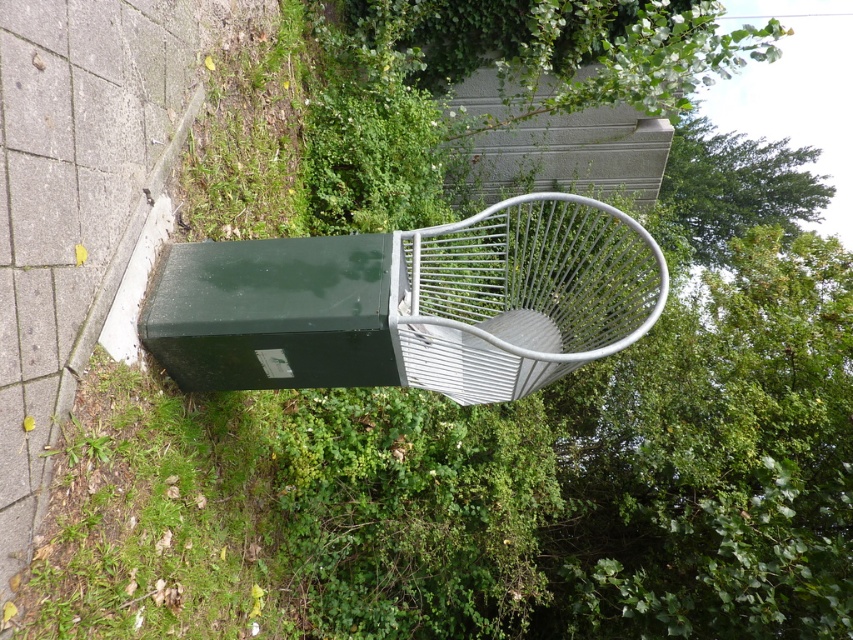
Question: Among these points, which one is farthest from the camera?

Choices:
 (A) (49, 577)
 (B) (335, 1)
 (C) (770, 212)

Answer: (C)

Question: Based on their relative distances, which object is farther from the green grass at lower left?

Choices:
 (A) metallic wire chair at center
 (B) green leafy tree at upper right

Answer: (B)

Question: Does green grass at lower left have a greater width compared to green leafy tree at upper center?

Choices:
 (A) yes
 (B) no

Answer: (B)

Question: Which object appears closest to the camera in this image?

Choices:
 (A) metallic wire chair at center
 (B) green leafy tree at upper right
 (C) green leafy tree at upper center

Answer: (A)

Question: Considering the relative positions of metallic wire chair at center and green grass at lower left in the image provided, where is metallic wire chair at center located with respect to green grass at lower left?

Choices:
 (A) above
 (B) below

Answer: (A)

Question: Does green grass at lower left appear on the right side of green leafy tree at upper right?

Choices:
 (A) no
 (B) yes

Answer: (A)